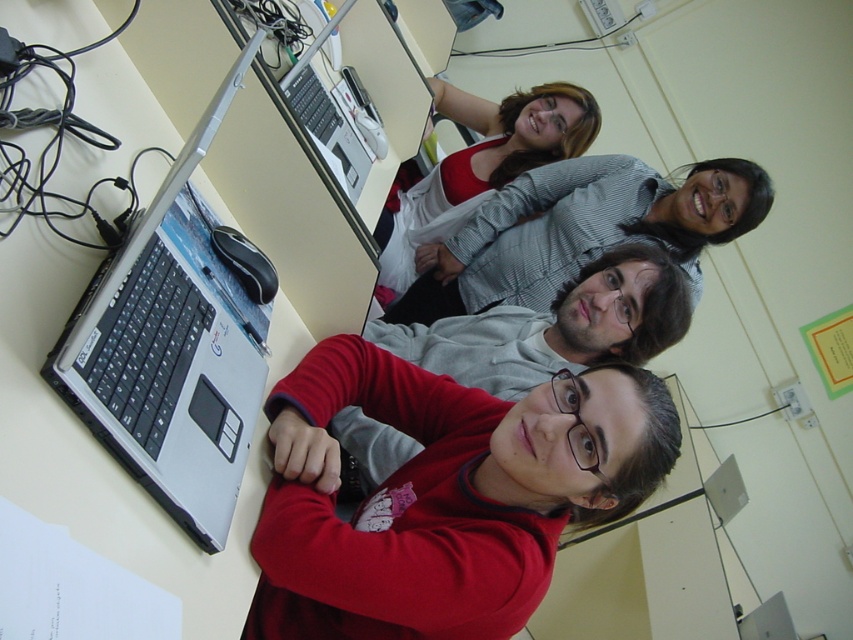
Does point (245, 444) come in front of point (381, 300)?

That is True.

Find the location of a particular element. silver/black plastic laptop at lower left is located at coordinates (169, 356).

Measure the distance between point (163,468) and camera.

86.54 centimeters

Find the location of a particular element. This screenshot has width=853, height=640. silver/black plastic laptop at lower left is located at coordinates (169, 356).

Is striped shirt at center closer to the viewer compared to matte gray sweater at center?

That is True.

Describe the element at coordinates (582, 228) in the screenshot. I see `striped shirt at center` at that location.

Image resolution: width=853 pixels, height=640 pixels. What do you see at coordinates (582, 228) in the screenshot? I see `striped shirt at center` at bounding box center [582, 228].

The height and width of the screenshot is (640, 853). Find the location of `striped shirt at center`. striped shirt at center is located at coordinates (582, 228).

Does silver/black plastic laptop at lower left appear on the right side of striped shirt at center?

In fact, silver/black plastic laptop at lower left is to the left of striped shirt at center.

Can you confirm if silver/black plastic laptop at lower left is bigger than striped shirt at center?

Incorrect, silver/black plastic laptop at lower left is not larger than striped shirt at center.

Is point (67, 340) more distant than point (447, 257)?

No, (67, 340) is in front of (447, 257).

The height and width of the screenshot is (640, 853). What are the coordinates of `silver/black plastic laptop at lower left` in the screenshot? It's located at (169, 356).